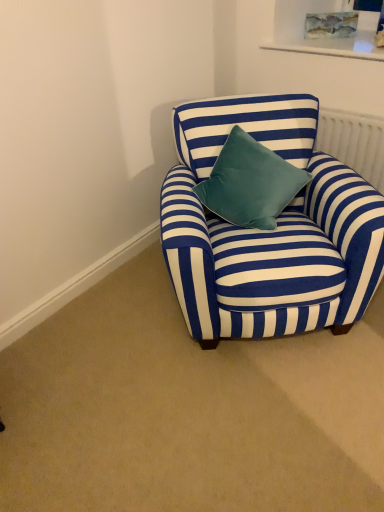
Describe the element at coordinates (354, 143) in the screenshot. This screenshot has height=512, width=384. I see `white textured radiator at upper right` at that location.

Where is `velvet teal pillow at center`? Image resolution: width=384 pixels, height=512 pixels. velvet teal pillow at center is located at coordinates (250, 183).

Locate an element on the screen. white textured radiator at upper right is located at coordinates (354, 143).

From a real-world perspective, is white textured radiator at upper right positioned above or below velvet teal pillow at center?

white textured radiator at upper right is situated lower than velvet teal pillow at center in the real world.

Is white textured radiator at upper right oriented away from velvet teal pillow at center?

No, white textured radiator at upper right is not facing the opposite direction of velvet teal pillow at center.

Can you confirm if white textured radiator at upper right is taller than velvet teal pillow at center?

Incorrect, the height of white textured radiator at upper right is not larger of that of velvet teal pillow at center.

Who is taller, blue striped fabric armchair at center or velvet teal pillow at center?

With more height is blue striped fabric armchair at center.

Is point (248, 286) less distant than point (266, 155)?

Yes.

Which object is thinner, blue striped fabric armchair at center or velvet teal pillow at center?

velvet teal pillow at center is thinner.

Does point (246, 181) come farther from viewer compared to point (321, 138)?

No, it is in front of (321, 138).

Considering the sizes of velvet teal pillow at center and white textured radiator at upper right in the image, is velvet teal pillow at center wider or thinner than white textured radiator at upper right?

Clearly, velvet teal pillow at center has more width compared to white textured radiator at upper right.

Does point (375, 166) appear closer or farther from the camera than point (339, 232)?

Point (375, 166) is farther from the camera than point (339, 232).

Considering the sizes of objects white textured radiator at upper right and blue striped fabric armchair at center in the image provided, who is bigger, white textured radiator at upper right or blue striped fabric armchair at center?

With larger size is blue striped fabric armchair at center.

From a real-world perspective, is white textured radiator at upper right above or below blue striped fabric armchair at center?

Clearly, from a real-world perspective, white textured radiator at upper right is above blue striped fabric armchair at center.

Between white textured radiator at upper right and blue striped fabric armchair at center, which one has smaller width?

Thinner between the two is white textured radiator at upper right.

From the image's perspective, which is below, blue striped fabric armchair at center or white textured radiator at upper right?

blue striped fabric armchair at center.

How many degrees apart are the facing directions of blue striped fabric armchair at center and white textured radiator at upper right?

They differ by 42.2 degrees in their facing directions.

From a real-world perspective, which object rests below the other?

blue striped fabric armchair at center, from a real-world perspective.

Considering the relative sizes of velvet teal pillow at center and blue striped fabric armchair at center in the image provided, is velvet teal pillow at center bigger than blue striped fabric armchair at center?

No.

From a real-world perspective, is velvet teal pillow at center located beneath blue striped fabric armchair at center?

Incorrect, from a real-world perspective, velvet teal pillow at center is higher than blue striped fabric armchair at center.

How many degrees apart are the facing directions of velvet teal pillow at center and blue striped fabric armchair at center?

The facing directions of velvet teal pillow at center and blue striped fabric armchair at center are 10.4 degrees apart.

Locate an element on the screen. The image size is (384, 512). pillow located below the white textured radiator at upper right (from the image's perspective) is located at coordinates (250, 183).

What are the coordinates of `pillow on the left of blue striped fabric armchair at center` in the screenshot? It's located at (250, 183).

From the image, which object appears to be nearer to velvet teal pillow at center, white textured radiator at upper right or blue striped fabric armchair at center?

Among the two, blue striped fabric armchair at center is located nearer to velvet teal pillow at center.

Which object lies nearer to the anchor point white textured radiator at upper right, velvet teal pillow at center or blue striped fabric armchair at center?

The object closer to white textured radiator at upper right is blue striped fabric armchair at center.

When comparing their distances from white textured radiator at upper right, does blue striped fabric armchair at center or velvet teal pillow at center seem closer?

blue striped fabric armchair at center lies closer to white textured radiator at upper right than the other object.

Based on their spatial positions, is white textured radiator at upper right or velvet teal pillow at center further from blue striped fabric armchair at center?

white textured radiator at upper right.

Based on their spatial positions, is blue striped fabric armchair at center or white textured radiator at upper right further from velvet teal pillow at center?

white textured radiator at upper right lies further to velvet teal pillow at center than the other object.

In the scene shown: Considering their positions, is velvet teal pillow at center positioned closer to blue striped fabric armchair at center than white textured radiator at upper right?

velvet teal pillow at center is closer to blue striped fabric armchair at center.

Where is `pillow positioned between blue striped fabric armchair at center and white textured radiator at upper right from near to far`? The height and width of the screenshot is (512, 384). pillow positioned between blue striped fabric armchair at center and white textured radiator at upper right from near to far is located at coordinates (250, 183).